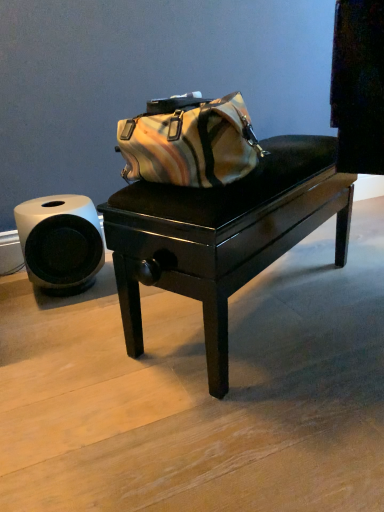
Question: Considering the positions of glossy black table at center and white matte toilet paper at left in the image, is glossy black table at center taller or shorter than white matte toilet paper at left?

Choices:
 (A) short
 (B) tall

Answer: (B)

Question: Relative to white matte toilet paper at left, is glossy black table at center in front or behind?

Choices:
 (A) behind
 (B) front

Answer: (B)

Question: Is glossy black table at center wider or thinner than white matte toilet paper at left?

Choices:
 (A) wide
 (B) thin

Answer: (A)

Question: Choose the correct answer: Is white matte toilet paper at left inside glossy black table at center or outside it?

Choices:
 (A) outside
 (B) inside

Answer: (A)

Question: Considering the positions of white matte toilet paper at left and glossy black table at center in the image, is white matte toilet paper at left bigger or smaller than glossy black table at center?

Choices:
 (A) small
 (B) big

Answer: (A)

Question: From a real-world perspective, is white matte toilet paper at left above or below glossy black table at center?

Choices:
 (A) below
 (B) above

Answer: (A)

Question: Would you say white matte toilet paper at left is to the left or to the right of glossy black table at center in the picture?

Choices:
 (A) left
 (B) right

Answer: (A)